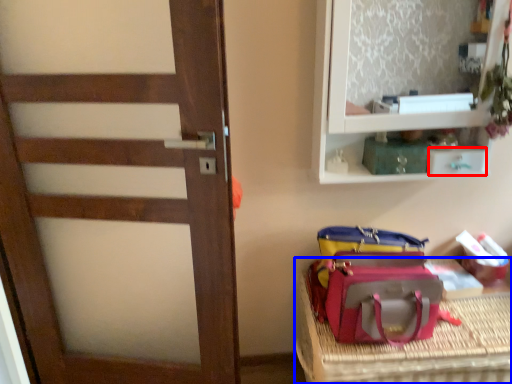
Question: Which object is closer to the camera taking this photo, drawer (highlighted by a red box) or furniture (highlighted by a blue box)?

Choices:
 (A) drawer
 (B) furniture

Answer: (B)